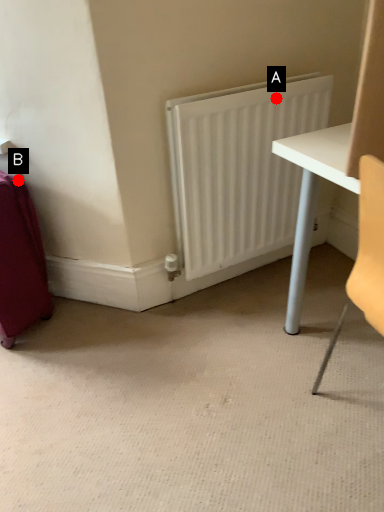
Question: Two points are circled on the image, labeled by A and B beside each circle. Which point is closer to the camera taking this photo?

Choices:
 (A) A is closer
 (B) B is closer

Answer: (A)